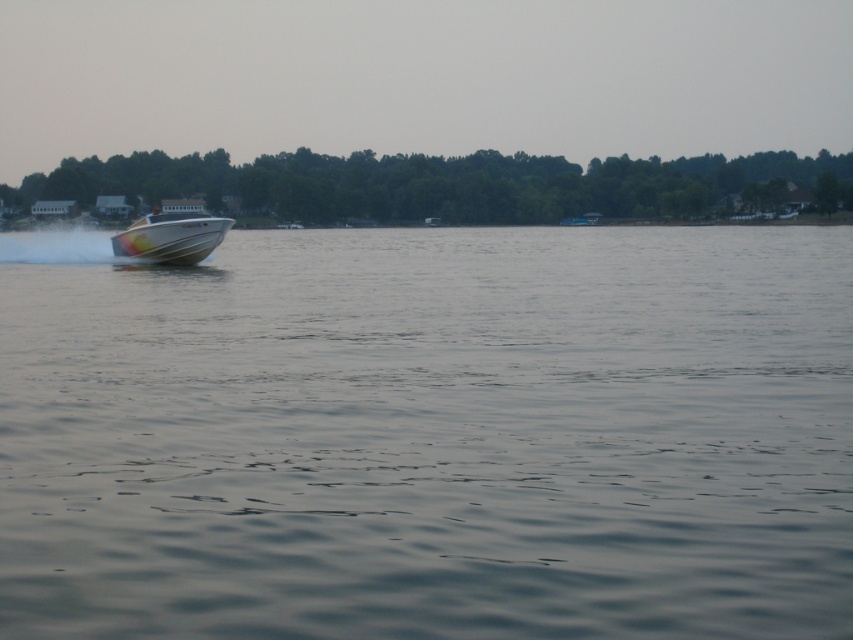
Between clear water at center and white glossy boat at left, which one is positioned higher?

Positioned higher is white glossy boat at left.

Which is behind, point (51, 576) or point (143, 230)?

The point (143, 230) is behind.

At what (x,y) coordinates should I click in order to perform the action: click on clear water at center. Please return your answer as a coordinate pair (x, y). This screenshot has width=853, height=640. Looking at the image, I should click on (430, 435).